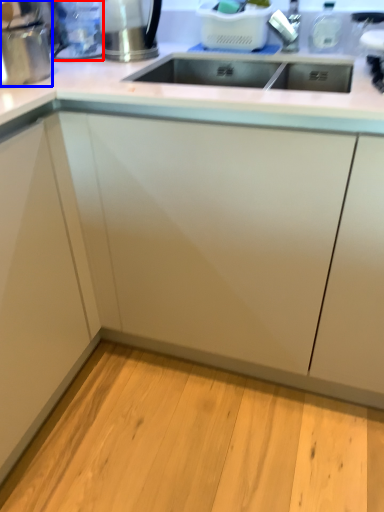
Question: Which object is further to the camera taking this photo, appliance (highlighted by a red box) or appliance (highlighted by a blue box)?

Choices:
 (A) appliance
 (B) appliance

Answer: (A)